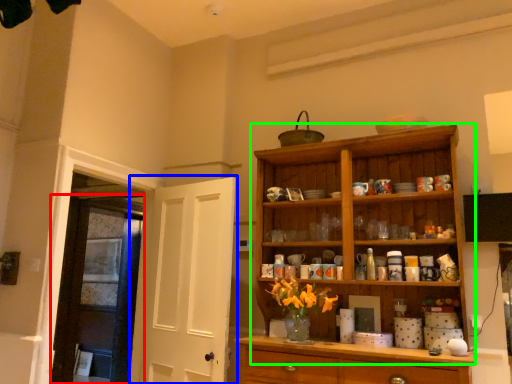
Question: Which object is the closest to the door (highlighted by a red box)? Choose among these: door (highlighted by a blue box) or cupboard (highlighted by a green box).

Choices:
 (A) door
 (B) cupboard

Answer: (A)